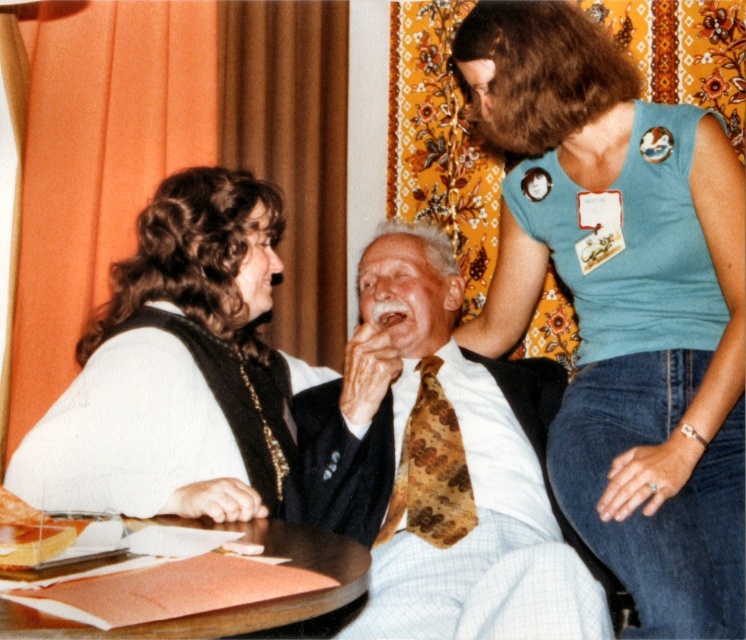
Question: Does white fuzzy vest at left have a lesser width compared to brown floral fabric tie at center?

Choices:
 (A) yes
 (B) no

Answer: (B)

Question: Does blue fabric shirt at upper right appear over brown floral fabric tie at center?

Choices:
 (A) no
 (B) yes

Answer: (B)

Question: Does white fuzzy vest at left have a larger size compared to brown floral fabric tie at center?

Choices:
 (A) no
 (B) yes

Answer: (B)

Question: Which object appears closest to the camera in this image?

Choices:
 (A) smooth brown paper at lower center
 (B) brown floral fabric tie at center
 (C) blue fabric shirt at upper right
 (D) white fuzzy vest at left

Answer: (A)

Question: Which of these objects is positioned farthest from the floral tie at center?

Choices:
 (A) smooth brown paper at lower center
 (B) brown floral fabric tie at center
 (C) blue fabric shirt at upper right
 (D) white fuzzy vest at left

Answer: (A)

Question: Which point is closer to the camera taking this photo?

Choices:
 (A) (101, 451)
 (B) (454, 353)
 (C) (589, 349)
 (D) (162, 520)

Answer: (D)